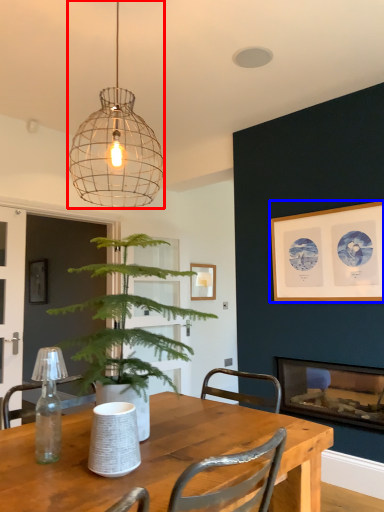
Question: Which of the following is the closest to the observer, lamp (highlighted by a red box) or picture frame (highlighted by a blue box)?

Choices:
 (A) lamp
 (B) picture frame

Answer: (A)